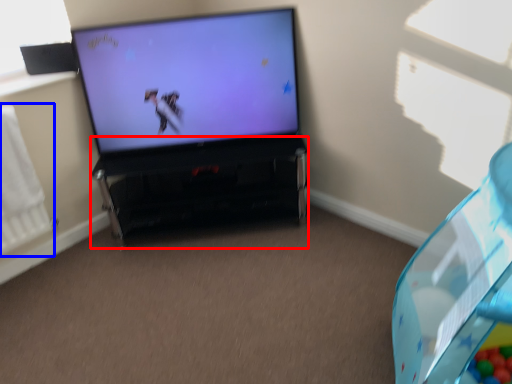
Question: Among these objects, which one is nearest to the camera, furniture (highlighted by a red box) or radiator (highlighted by a blue box)?

Choices:
 (A) furniture
 (B) radiator

Answer: (B)